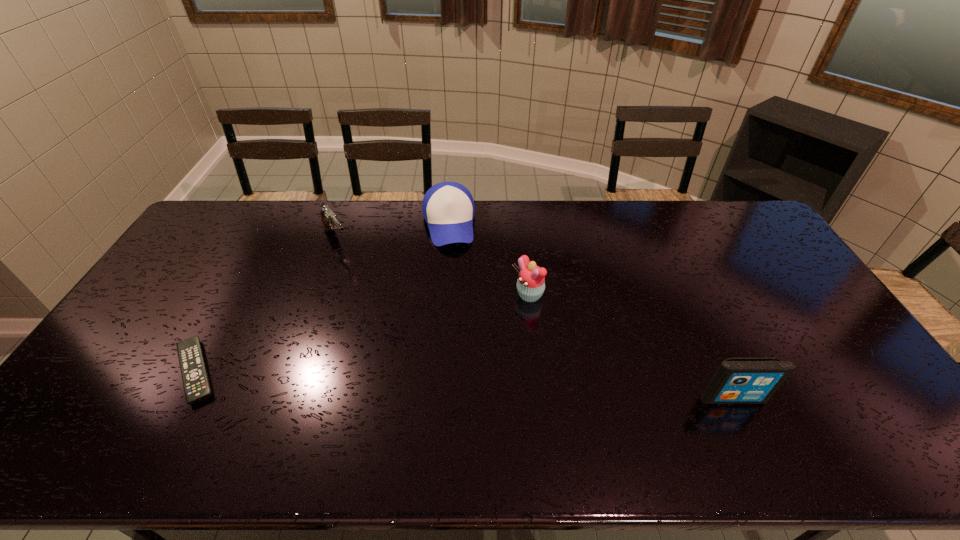
This screenshot has width=960, height=540. Find the location of `the leftmost object`. the leftmost object is located at coordinates (196, 384).

You are a GUI agent. You are given a task and a screenshot of the screen. Output one action in this format:
    pyautogui.click(x=<x>, y=<y>)
    Task: Click on the shortest object
    This screenshot has height=540, width=960.
    Given the screenshot: What is the action you would take?
    pyautogui.click(x=196, y=384)

The height and width of the screenshot is (540, 960). In order to click on the rightmost object in this screenshot , I will do `click(737, 380)`.

Locate an element on the screen. The height and width of the screenshot is (540, 960). the third nearest object is located at coordinates (531, 281).

I want to click on the second object from right to left, so click(531, 281).

This screenshot has height=540, width=960. I want to click on the third object from left to right, so click(448, 208).

Image resolution: width=960 pixels, height=540 pixels. Identify the location of pistol. (329, 219).

Identify the location of vacant space located 0.310m on the back of the leftmost object. (253, 265).

The height and width of the screenshot is (540, 960). Find the location of `vacant space situated 0.390m on the face of the second object from right to left`. vacant space situated 0.390m on the face of the second object from right to left is located at coordinates (404, 372).

Identify the location of vacant space situated on the face of the second object from right to left. (482, 325).